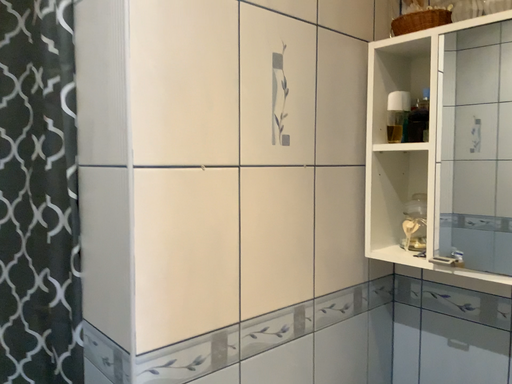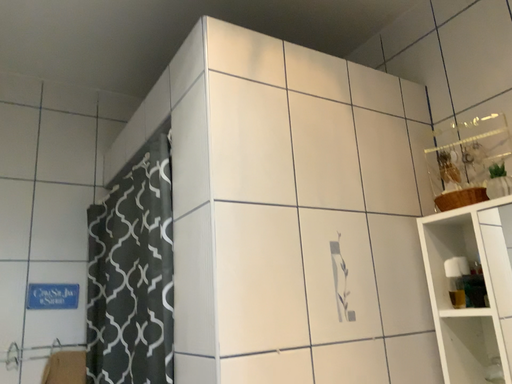
Question: How did the camera likely rotate when shooting the video?

Choices:
 (A) rotated upward
 (B) rotated downward

Answer: (A)